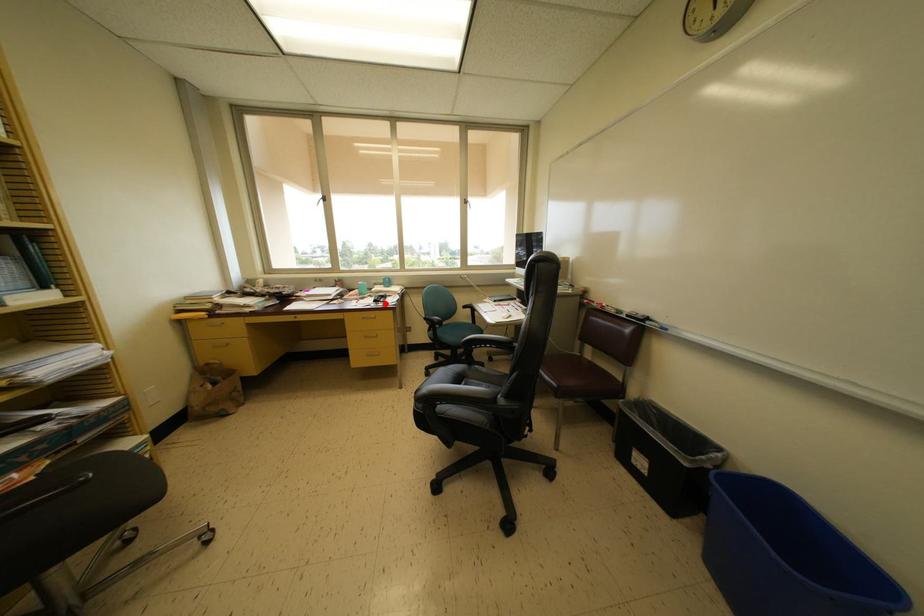
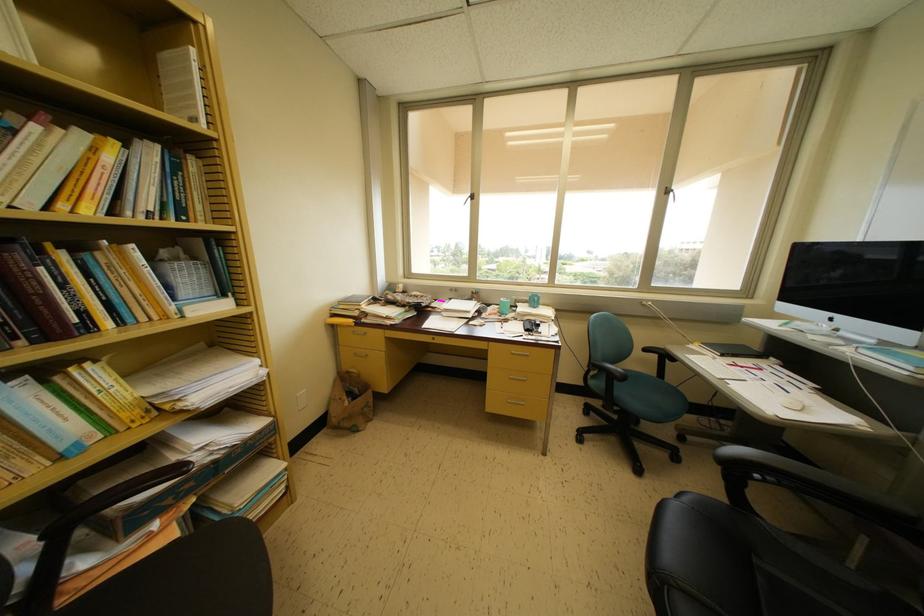
Where in the second image is the point corresponding to the highlighted location from the first image?

(537, 331)